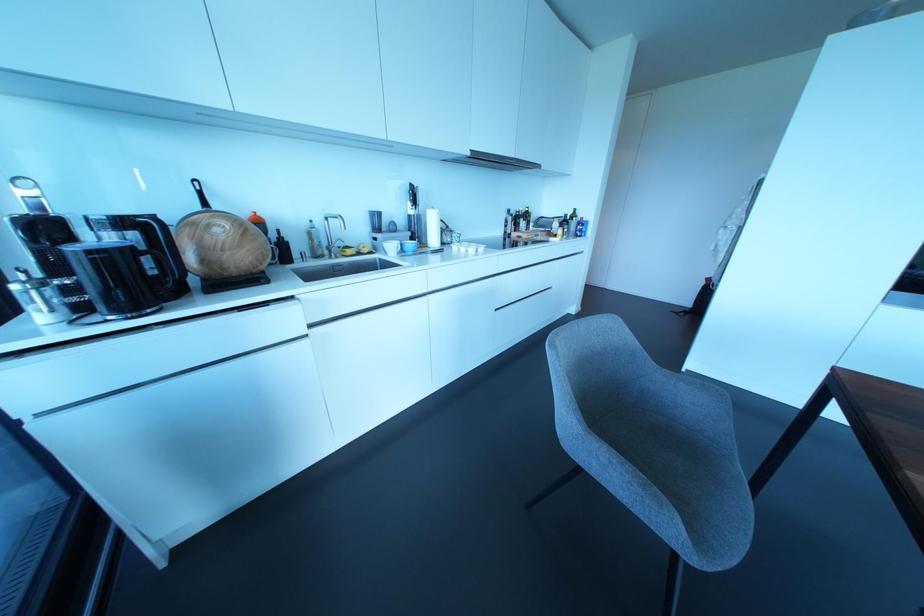
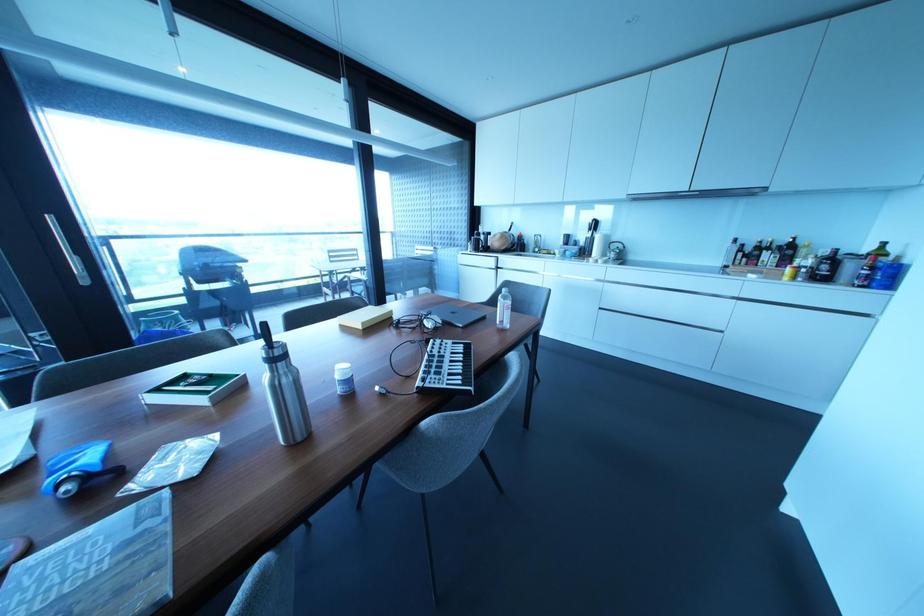
Find the pixel in the second image that matches (564,220) in the first image.

(833, 257)